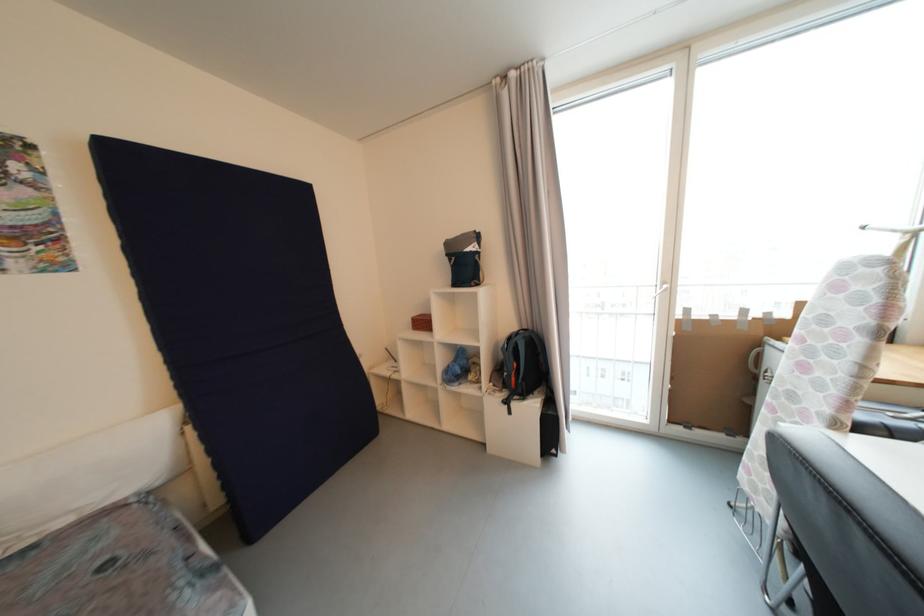
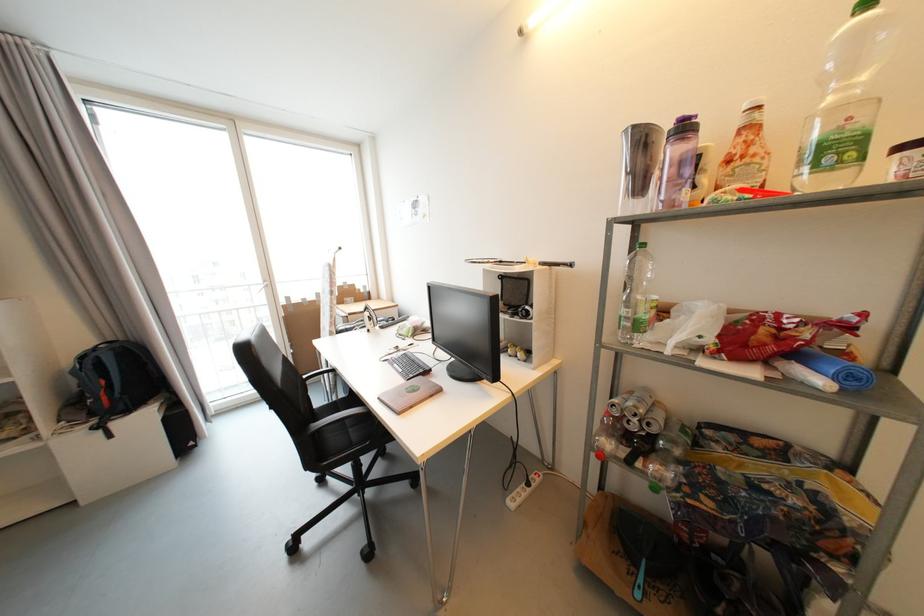
Where in the second image is the point corresponding to [669,285] from the first image?

(271, 283)